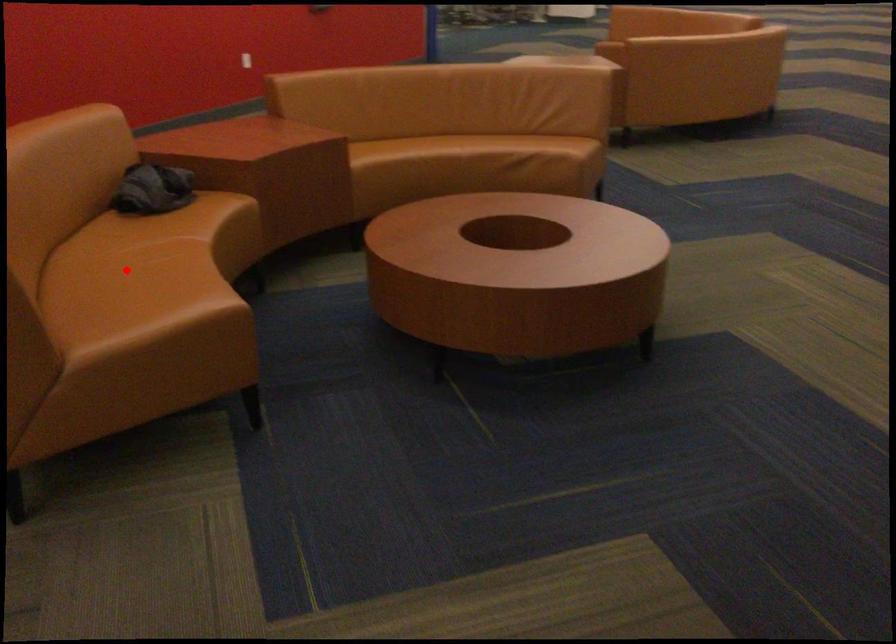
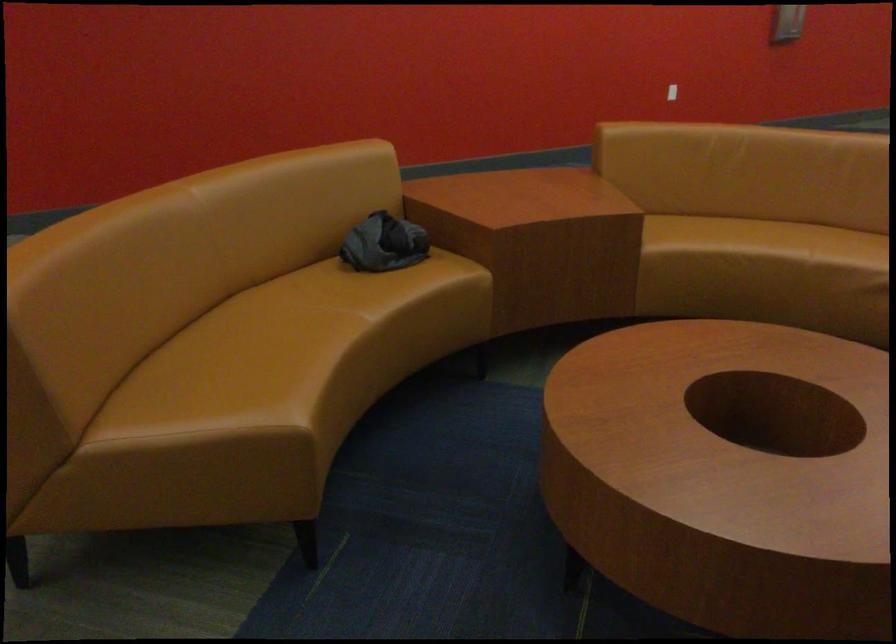
Question: I am providing you with two images of the same scene from different viewpoints. Given a red point in image1, look at the same physical point in image2. Is it:

Choices:
 (A) Closer to the viewpoint
 (B) Farther from the viewpoint

Answer: (A)